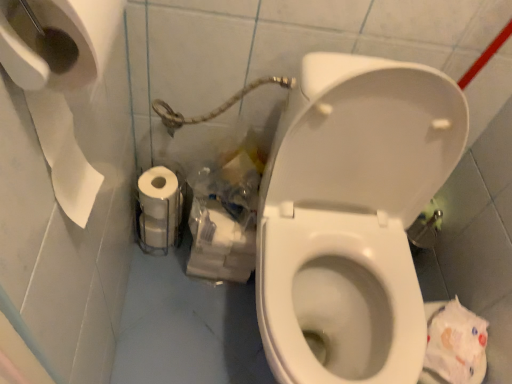
Question: Does translucent plastic bag at lower center have a smaller size compared to white matte toilet paper at lower left?

Choices:
 (A) no
 (B) yes

Answer: (A)

Question: Can you see translucent plastic bag at lower center touching white matte toilet paper at lower left?

Choices:
 (A) no
 (B) yes

Answer: (A)

Question: Is white matte toilet paper at lower left located within translucent plastic bag at lower center?

Choices:
 (A) yes
 (B) no

Answer: (B)

Question: Considering the relative positions of translucent plastic bag at lower center and white matte toilet paper at lower left in the image provided, is translucent plastic bag at lower center to the left of white matte toilet paper at lower left from the viewer's perspective?

Choices:
 (A) yes
 (B) no

Answer: (B)

Question: From a real-world perspective, is translucent plastic bag at lower center on top of white matte toilet paper at lower left?

Choices:
 (A) yes
 (B) no

Answer: (A)

Question: From the image's perspective, is translucent plastic bag at lower center on top of white matte toilet paper at lower left?

Choices:
 (A) yes
 (B) no

Answer: (B)

Question: Does white glossy toilet at center touch translucent plastic bag at lower center?

Choices:
 (A) no
 (B) yes

Answer: (A)

Question: Considering the relative sizes of white glossy toilet at center and translucent plastic bag at lower center in the image provided, is white glossy toilet at center taller than translucent plastic bag at lower center?

Choices:
 (A) no
 (B) yes

Answer: (B)

Question: From the image's perspective, is white glossy toilet at center on translucent plastic bag at lower center?

Choices:
 (A) no
 (B) yes

Answer: (A)

Question: Can you confirm if white glossy toilet at center is positioned to the left of translucent plastic bag at lower center?

Choices:
 (A) yes
 (B) no

Answer: (B)

Question: Is white glossy toilet at center aimed at translucent plastic bag at lower center?

Choices:
 (A) yes
 (B) no

Answer: (B)

Question: From a real-world perspective, is white glossy toilet at center on top of translucent plastic bag at lower center?

Choices:
 (A) no
 (B) yes

Answer: (B)

Question: From a real-world perspective, is translucent plastic bag at lower center located beneath white glossy toilet at center?

Choices:
 (A) no
 (B) yes

Answer: (B)